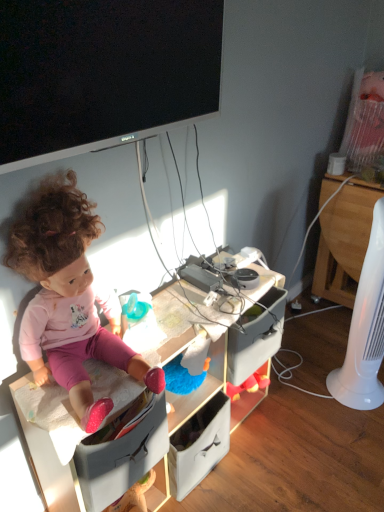
This screenshot has width=384, height=512. What are the coordinates of `vacant space in front of white plastic fan at right` in the screenshot? It's located at (355, 428).